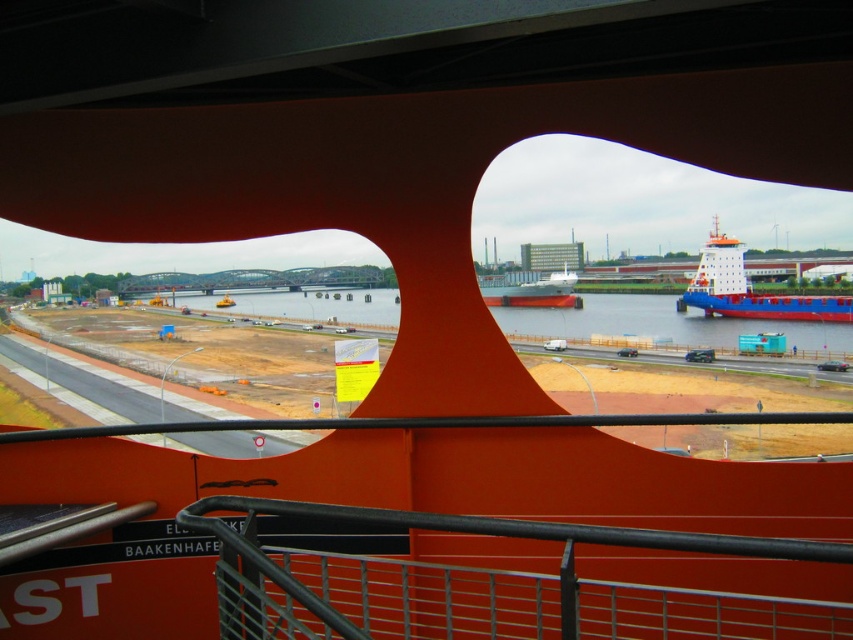
You are a photographer standing on the red structure and want to capture both the metallic gray rail at center and the blue matte container ship at right in a single shot. Which object will appear larger in your photo?

The blue matte container ship at right will appear larger in the photo because it is larger than the metallic gray rail at center.

You are a tour guide explaining the ships in the image. Which ship is narrower between the blue matte container ship at right and the white matte cargo ship at center?

The blue matte container ship at right is narrower than the white matte cargo ship at center.

You are standing on the red curved structure and looking out. Which object, the blue water at center or the blue matte container ship at right, appears closer to you based on their sizes in the image?

The blue water at center appears closer to you because it is shorter than the blue matte container ship at right, which is farther away and thus appears smaller.